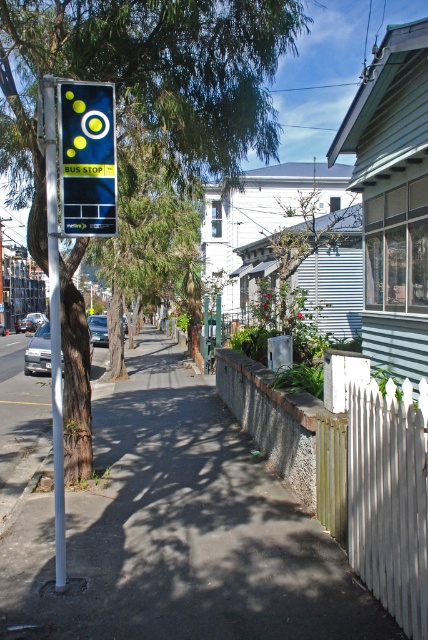
Who is positioned more to the right, green leafy tree at upper left or white metallic pole at left?

green leafy tree at upper left

The image size is (428, 640). What do you see at coordinates (146, 77) in the screenshot?
I see `green leafy tree at upper left` at bounding box center [146, 77].

Find the location of a particular element. This screenshot has width=428, height=640. green leafy tree at upper left is located at coordinates (146, 77).

Does smooth concrete pavement at center have a greater width compared to green leafy tree at upper left?

Indeed, smooth concrete pavement at center has a greater width compared to green leafy tree at upper left.

Where is `smooth concrete pavement at center`? The image size is (428, 640). smooth concrete pavement at center is located at coordinates (180, 531).

Where is `smooth concrete pavement at center`? This screenshot has width=428, height=640. smooth concrete pavement at center is located at coordinates (180, 531).

From the picture: Which of these two, green leafy tree at upper left or matte black sign at upper left, stands shorter?

Standing shorter between the two is green leafy tree at upper left.

Identify the location of green leafy tree at upper left. (146, 77).